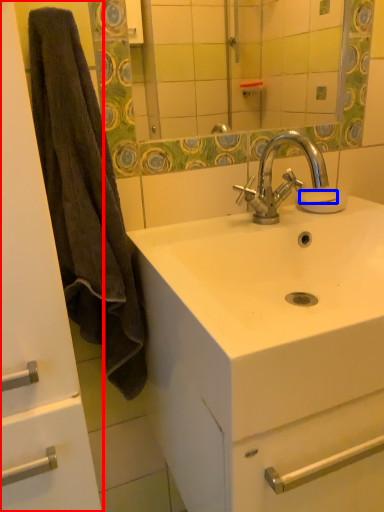
Question: Which point is closer to the camera, bathroom cabinet (highlighted by a red box) or soap (highlighted by a blue box)?

Choices:
 (A) bathroom cabinet
 (B) soap

Answer: (A)